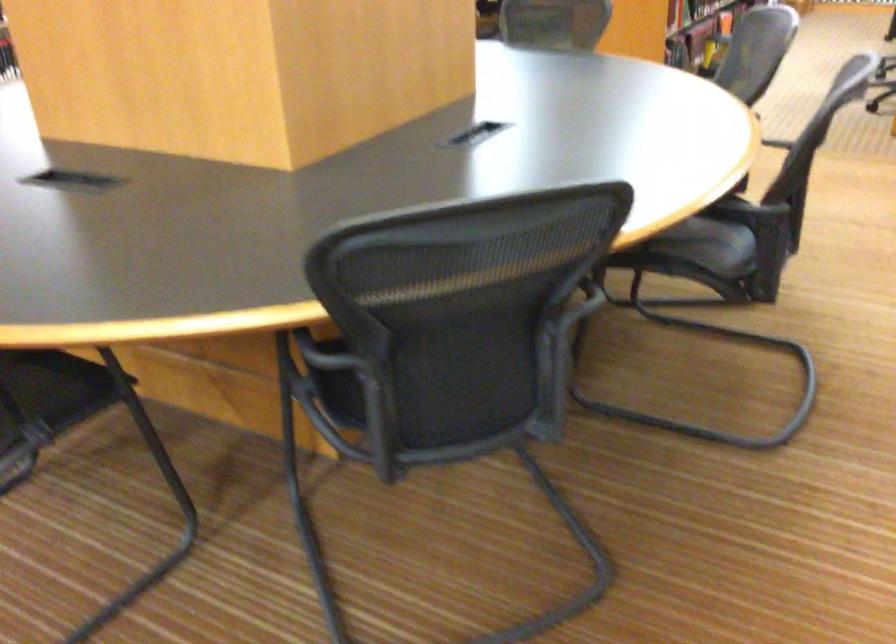
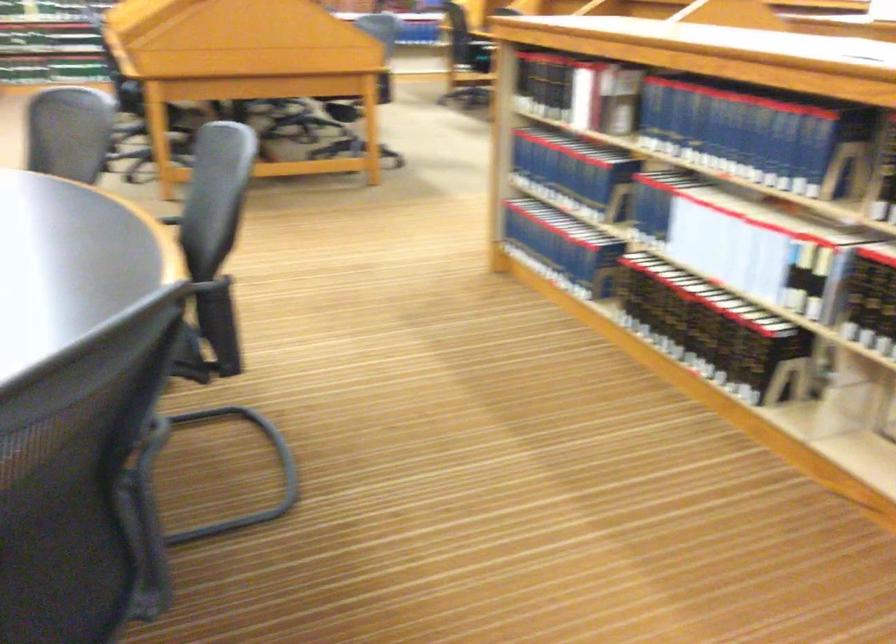
Question: The camera is either moving clockwise (left) or counter-clockwise (right) around the object. The first image is from the beginning of the video and the second image is from the end. Is the camera moving left or right when shooting the video?

Choices:
 (A) Left
 (B) Right

Answer: (A)